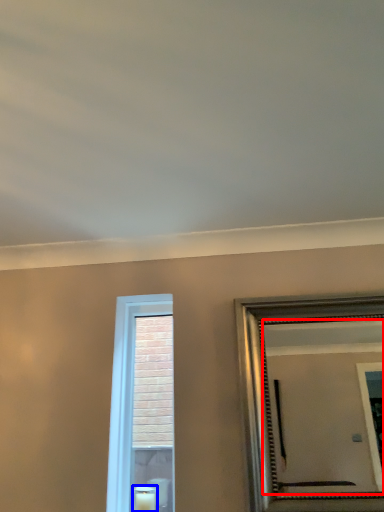
Question: Which of the following is the farthest to the observer, mirror (highlighted by a red box) or candle (highlighted by a blue box)?

Choices:
 (A) mirror
 (B) candle

Answer: (B)